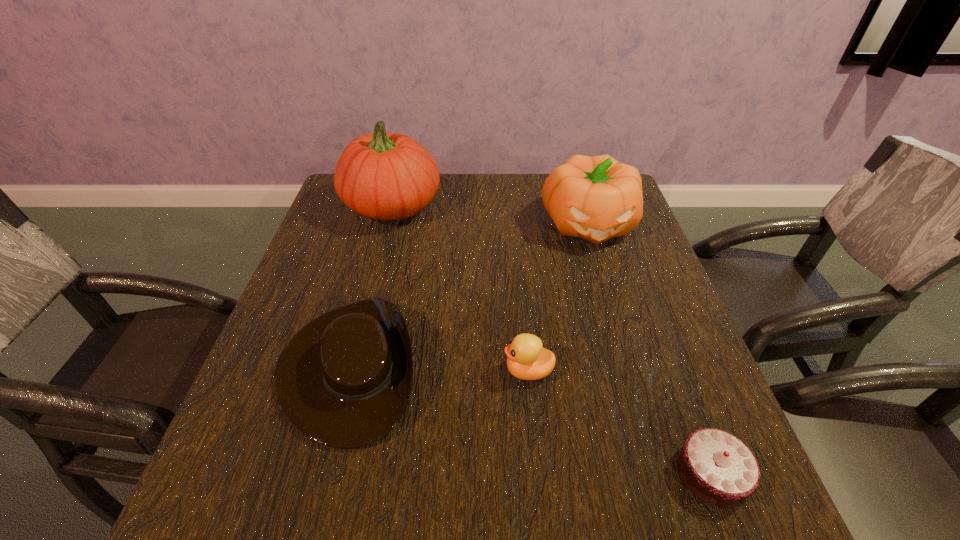
The width and height of the screenshot is (960, 540). Find the location of `free space that satisfies the following two spatial constraints: 1. on the face of the chocolate cake; 2. on the left side of the duckling`. free space that satisfies the following two spatial constraints: 1. on the face of the chocolate cake; 2. on the left side of the duckling is located at coordinates (539, 473).

The height and width of the screenshot is (540, 960). Identify the location of free location that satisfies the following two spatial constraints: 1. on the carved face of the chocolate cake; 2. on the right side of the fourth shortest object. (663, 473).